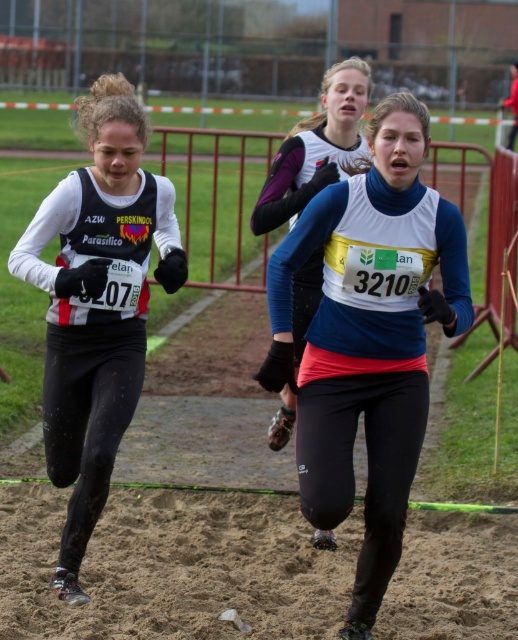
Does point (348, 292) come farther from viewer compared to point (76, 221)?

No.

Does point (267, 262) come behind point (49, 435)?

Yes.

Image resolution: width=518 pixels, height=640 pixels. I want to click on blue fleece jacket at center, so click(x=367, y=339).